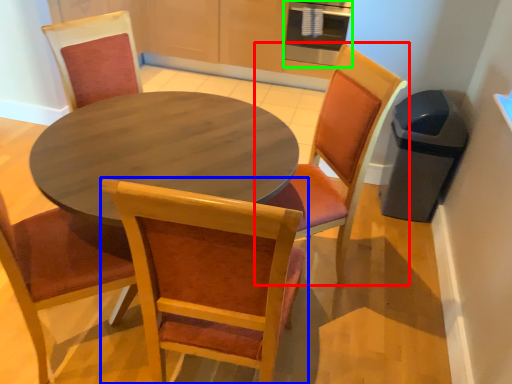
Question: Which is farther away from chair (highlighted by a red box)? chair (highlighted by a blue box) or appliance (highlighted by a green box)?

Choices:
 (A) chair
 (B) appliance

Answer: (B)